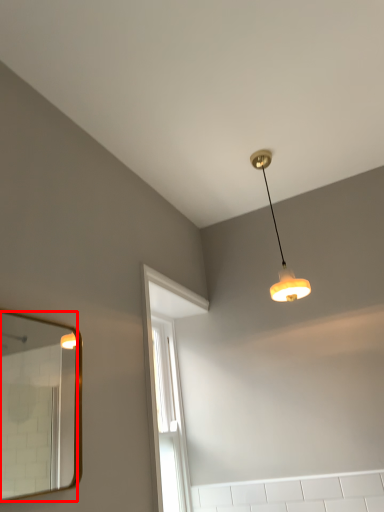
Question: Where is mirror (annotated by the red box) located in relation to lamp in the image?

Choices:
 (A) left
 (B) right

Answer: (A)